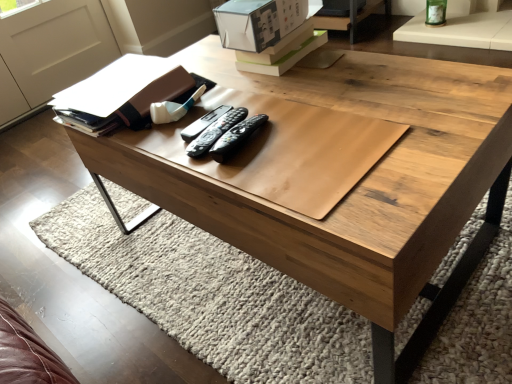
You are a GUI agent. You are given a task and a screenshot of the screen. Output one action in this format:
    pyautogui.click(x=<x>, y=<y>)
    Task: Click on the empty space that is ontop of matte brown book at upper left (from a real-world perspective)
    
    Given the screenshot: What is the action you would take?
    click(110, 79)